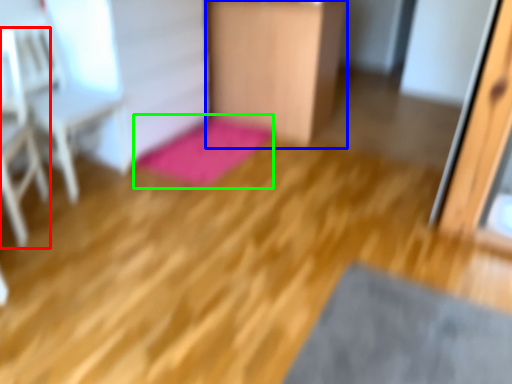
Question: Based on their relative distances, which object is nearer to armchair (highlighted by a red box)? Choose from furniture (highlighted by a blue box) and bath mat (highlighted by a green box).

Choices:
 (A) furniture
 (B) bath mat

Answer: (B)